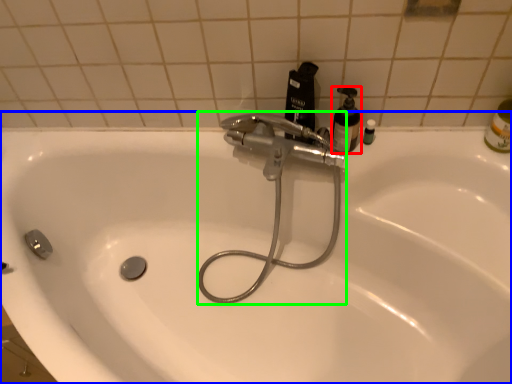
Question: Which is farther away from mouthwash (highlighted by a red box)? sink (highlighted by a blue box) or plumbing fixture (highlighted by a green box)?

Choices:
 (A) sink
 (B) plumbing fixture

Answer: (A)